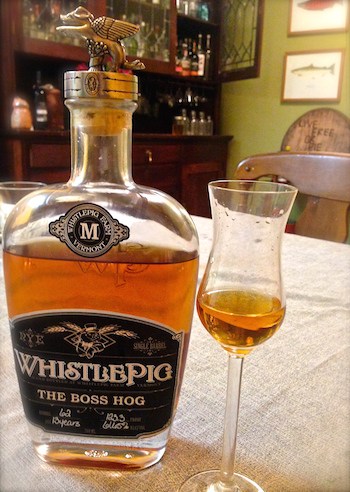
Locate an element on the screen. The image size is (350, 492). liquor cabinets is located at coordinates (202, 109), (198, 163), (47, 162).